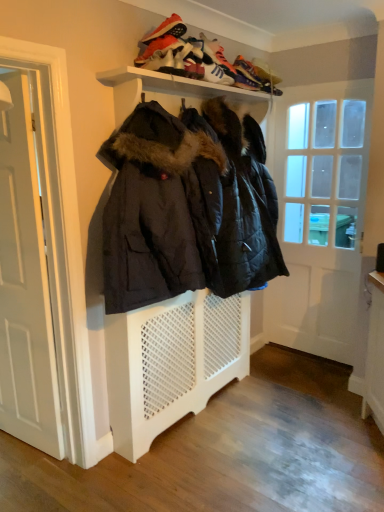
Question: From a real-world perspective, is white suede sneaker at upper center, which ranks as the first shoe in front-to-back order, above or below white matte shelf at upper center?

Choices:
 (A) above
 (B) below

Answer: (A)

Question: Considering the positions of white suede sneaker at upper center, the 4th shoe when ordered from back to front, and white matte shelf at upper center in the image, is white suede sneaker at upper center, the 4th shoe when ordered from back to front, taller or shorter than white matte shelf at upper center?

Choices:
 (A) short
 (B) tall

Answer: (A)

Question: Considering the real-world distances, which object is closest to the white glossy door at right, placed as the second door when sorted from left to right?

Choices:
 (A) white wooden door at left, which is the 2th door in right-to-left order
 (B) white matte shelf at upper center
 (C) orange suede sneaker at upper center
 (D) white suede sneaker at upper center, which ranks as the first shoe in front-to-back order
 (E) leather suede sneaker at upper center, which ranks as the second shoe in front-to-back order

Answer: (B)

Question: Estimate the real-world distances between objects in this image. Which object is closer to the shiny orange sneaker at upper center, which is counted as the 1th shoe, starting from the back?

Choices:
 (A) white suede sneaker at upper center, which ranks as the first shoe in front-to-back order
 (B) leather suede sneaker at upper center, which ranks as the second shoe in front-to-back order
 (C) orange suede sneaker at upper center
 (D) white leather sneaker at upper center, which ranks as the second shoe in back-to-front order
 (E) matte black jackets at center

Answer: (D)